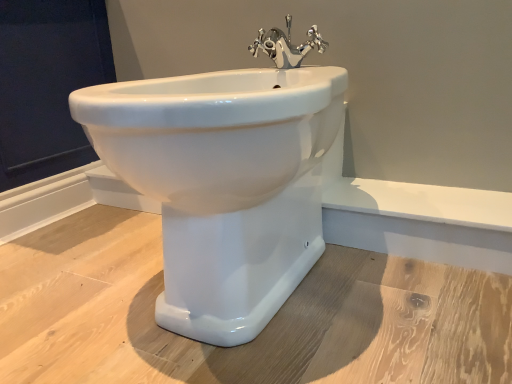
Identify the location of white glossy bidet at center. (223, 184).

Based on the photo, is dark blue fabric at upper left wider than chrome metallic faucet at upper center?

Correct, the width of dark blue fabric at upper left exceeds that of chrome metallic faucet at upper center.

Which object is positioned more to the right, dark blue fabric at upper left or chrome metallic faucet at upper center?

chrome metallic faucet at upper center is more to the right.

From the image's perspective, which is above, chrome metallic faucet at upper center or dark blue fabric at upper left?

dark blue fabric at upper left appears higher in the image.

Identify the location of screen door below the chrome metallic faucet at upper center (from a real-world perspective). This screenshot has height=384, width=512. (48, 83).

Between chrome metallic faucet at upper center and dark blue fabric at upper left, which one appears on the left side from the viewer's perspective?

dark blue fabric at upper left.

Does point (291, 16) appear closer or farther from the camera than point (30, 157)?

Point (291, 16) is closer to the camera than point (30, 157).

From a real-world perspective, which object stands above the other?

dark blue fabric at upper left.

This screenshot has width=512, height=384. Find the location of `sink that is under the dark blue fabric at upper left (from a real-world perspective)`. sink that is under the dark blue fabric at upper left (from a real-world perspective) is located at coordinates (223, 184).

Would you consider white glossy bidet at center to be distant from dark blue fabric at upper left?

That's not correct — white glossy bidet at center is a little close to dark blue fabric at upper left.

Which object is thinner, white glossy bidet at center or chrome metallic faucet at upper center?

chrome metallic faucet at upper center is thinner.

In the image, is white glossy bidet at center on the left side or the right side of chrome metallic faucet at upper center?

Based on their positions, white glossy bidet at center is located to the left of chrome metallic faucet at upper center.

Is white glossy bidet at center positioned in front of chrome metallic faucet at upper center?

Yes, the depth of white glossy bidet at center is less than that of chrome metallic faucet at upper center.

From the image's perspective, is white glossy bidet at center on top of chrome metallic faucet at upper center?

Actually, white glossy bidet at center appears below chrome metallic faucet at upper center in the image.

Where is `screen door that appears above the white glossy bidet at center (from the image's perspective)`? Image resolution: width=512 pixels, height=384 pixels. screen door that appears above the white glossy bidet at center (from the image's perspective) is located at coordinates (48, 83).

From a real-world perspective, is dark blue fabric at upper left physically located above or below white glossy bidet at center?

In terms of real-world spatial position, dark blue fabric at upper left is above white glossy bidet at center.

Considering the relative positions of dark blue fabric at upper left and white glossy bidet at center in the image provided, is dark blue fabric at upper left behind white glossy bidet at center?

Yes, dark blue fabric at upper left is further from the viewer.

Is dark blue fabric at upper left to the right of white glossy bidet at center from the viewer's perspective?

No.

Are chrome metallic faucet at upper center and white glossy bidet at center far apart?

No, chrome metallic faucet at upper center is in close proximity to white glossy bidet at center.

Which object is closer to the camera taking this photo, chrome metallic faucet at upper center or white glossy bidet at center?

white glossy bidet at center is closer to the camera.

Considering the relative sizes of chrome metallic faucet at upper center and white glossy bidet at center in the image provided, is chrome metallic faucet at upper center bigger than white glossy bidet at center?

Incorrect, chrome metallic faucet at upper center is not larger than white glossy bidet at center.

Where is `tap on the right of the dark blue fabric at upper left`? The width and height of the screenshot is (512, 384). tap on the right of the dark blue fabric at upper left is located at coordinates (286, 45).

At what (x,y) coordinates should I click in order to perform the action: click on screen door behind the chrome metallic faucet at upper center. Please return your answer as a coordinate pair (x, y). Image resolution: width=512 pixels, height=384 pixels. Looking at the image, I should click on (48, 83).

Looking at the image, which one is located further to white glossy bidet at center, dark blue fabric at upper left or chrome metallic faucet at upper center?

The object further to white glossy bidet at center is dark blue fabric at upper left.

From the image, which object appears to be farther from white glossy bidet at center, chrome metallic faucet at upper center or dark blue fabric at upper left?

dark blue fabric at upper left.

From the picture: Estimate the real-world distances between objects in this image. Which object is further from dark blue fabric at upper left, white glossy bidet at center or chrome metallic faucet at upper center?

white glossy bidet at center is positioned further to the anchor dark blue fabric at upper left.

Estimate the real-world distances between objects in this image. Which object is closer to chrome metallic faucet at upper center, dark blue fabric at upper left or white glossy bidet at center?

white glossy bidet at center lies closer to chrome metallic faucet at upper center than the other object.

Looking at the image, which one is located closer to chrome metallic faucet at upper center, white glossy bidet at center or dark blue fabric at upper left?

white glossy bidet at center lies closer to chrome metallic faucet at upper center than the other object.

When comparing their distances from dark blue fabric at upper left, does chrome metallic faucet at upper center or white glossy bidet at center seem closer?

Among the two, chrome metallic faucet at upper center is located nearer to dark blue fabric at upper left.

At what (x,y) coordinates should I click in order to perform the action: click on sink located between dark blue fabric at upper left and chrome metallic faucet at upper center in the left-right direction. Please return your answer as a coordinate pair (x, y). Image resolution: width=512 pixels, height=384 pixels. Looking at the image, I should click on (223, 184).